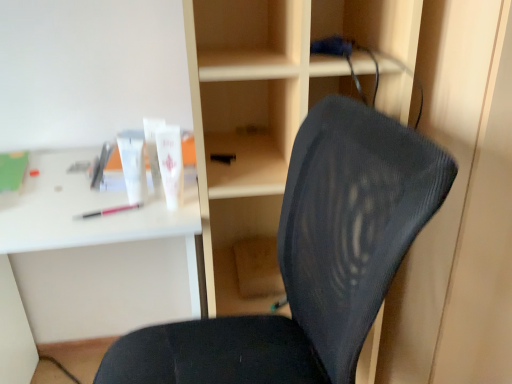
Question: Does white plastic desk at upper left lie in front of wooden at center?

Choices:
 (A) no
 (B) yes

Answer: (A)

Question: Does white plastic desk at upper left have a greater width compared to wooden at center?

Choices:
 (A) no
 (B) yes

Answer: (B)

Question: Is white plastic desk at upper left located outside wooden at center?

Choices:
 (A) yes
 (B) no

Answer: (A)

Question: From a real-world perspective, is white plastic desk at upper left beneath wooden at center?

Choices:
 (A) yes
 (B) no

Answer: (A)

Question: Is white plastic desk at upper left shorter than wooden at center?

Choices:
 (A) yes
 (B) no

Answer: (A)

Question: Is white plastic desk at upper left thinner than wooden at center?

Choices:
 (A) no
 (B) yes

Answer: (A)

Question: Can you confirm if wooden at center is positioned to the right of black mesh chair at center?

Choices:
 (A) yes
 (B) no

Answer: (A)

Question: Does wooden at center have a greater width compared to black mesh chair at center?

Choices:
 (A) no
 (B) yes

Answer: (A)

Question: From the image's perspective, is wooden at center on top of black mesh chair at center?

Choices:
 (A) no
 (B) yes

Answer: (B)

Question: Can black mesh chair at center be found inside wooden at center?

Choices:
 (A) no
 (B) yes

Answer: (A)

Question: Is wooden at center not inside black mesh chair at center?

Choices:
 (A) no
 (B) yes

Answer: (B)

Question: Does wooden at center have a smaller size compared to black mesh chair at center?

Choices:
 (A) yes
 (B) no

Answer: (A)

Question: Is white matte tube at upper center, the 3th toiletry in the left-to-right sequence, positioned before wooden at center?

Choices:
 (A) no
 (B) yes

Answer: (A)